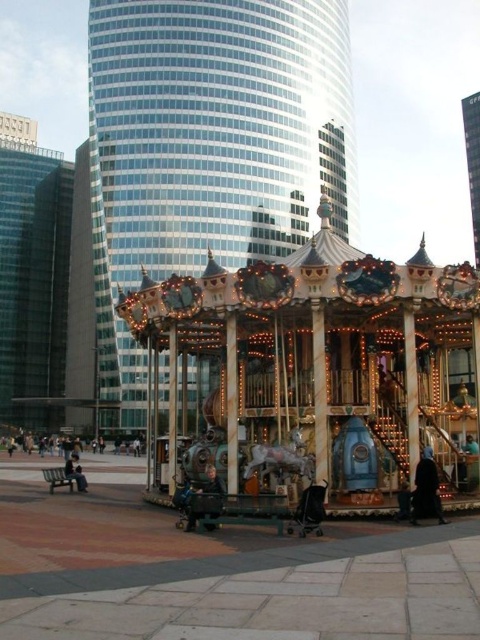
Based on the photo, you are standing at the point marked as point (322, 364) in the image. What object is directly in front of you?

The point (322, 364) corresponds to the wooden carousel at center, so the wooden carousel at center is directly in front of you.

You are standing at the base of the glassy steel tower at center. A small drone is at point (208, 148). Which direction should you look to see the drone?

The point (208, 148) is on the glassy steel tower at center, so you should look upward to see the drone at that point since it is on the tower above you.

You are a city planner assessing the urban layout. Given the presence of both the glassy steel tower at center and the wooden carousel at center, which structure would you need to consider for potential height restrictions to ensure they don not block the scenic view of the other?

The glassy steel tower at center is much taller than the wooden carousel at center, so the glassy steel tower at center would be the one requiring consideration for height restrictions to prevent it from obstructing the view of the wooden carousel at center.